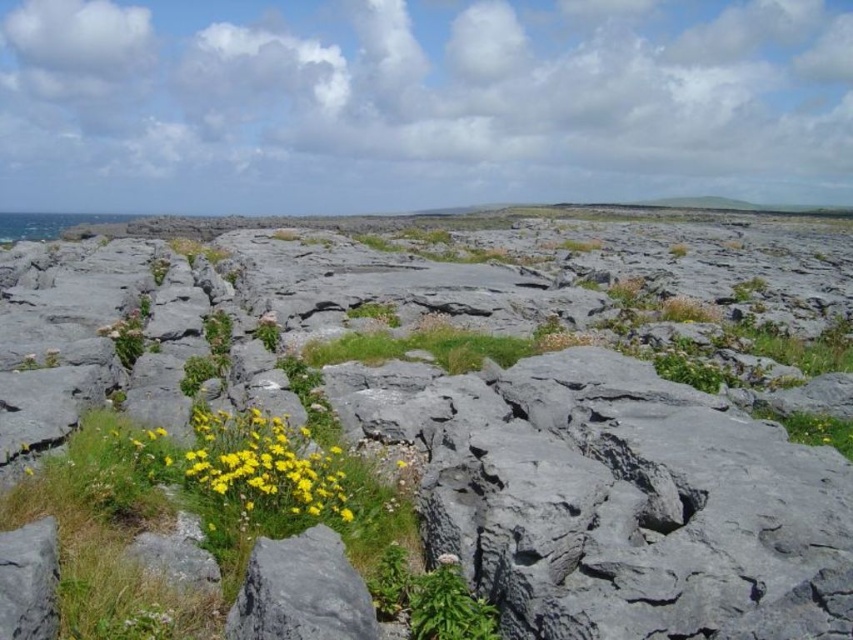
Which of these two, gray rough rock at lower center or green grass at center, stands shorter?

With less height is gray rough rock at lower center.

Is the position of gray rough rock at lower center more distant than that of green grass at center?

That is False.

At what (x,y) coordinates should I click in order to perform the action: click on gray rough rock at lower center. Please return your answer as a coordinate pair (x, y). Looking at the image, I should click on (300, 592).

Which is in front, point (426, 500) or point (508, 339)?

Point (426, 500)

Is the position of gray rough rock at center less distant than that of green grass at center?

Yes, it is.

This screenshot has width=853, height=640. I want to click on gray rough rock at center, so click(456, 420).

Does point (161, 272) come in front of point (286, 628)?

No.

Which is below, gray rough rock at center or gray rough rock at lower center?

Positioned lower is gray rough rock at lower center.

Who is more forward, (160, 248) or (343, 616)?

Point (343, 616) is in front.

Find the location of a particular element. The width and height of the screenshot is (853, 640). gray rough rock at center is located at coordinates (456, 420).